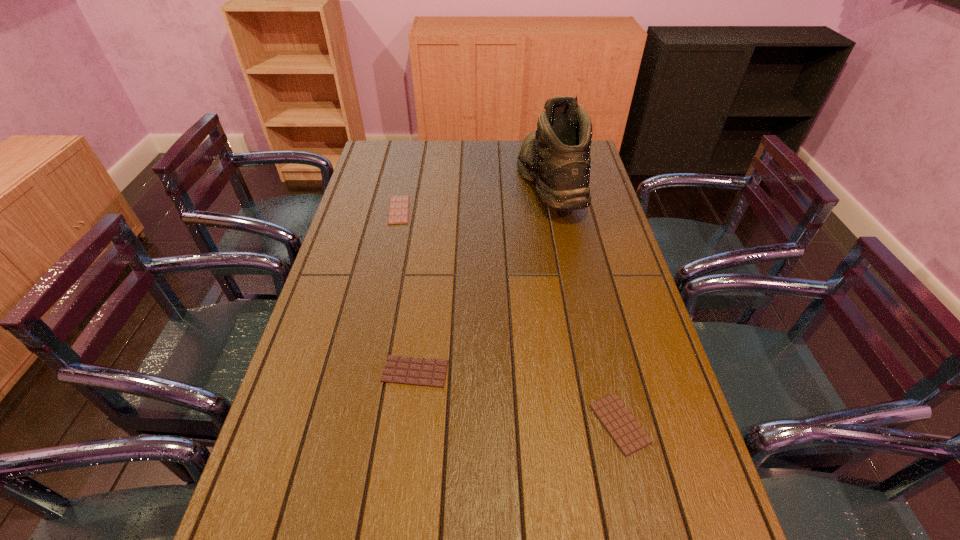
I want to click on the closest object to the second tallest object, so click(417, 371).

Identify which chocolate bar is located as the nearest to the rightmost chocolate bar. Please provide its 2D coordinates. Your answer should be formatted as a tuple, i.e. [(x, y)], where the tuple contains the x and y coordinates of a point satisfying the conditions above.

[(417, 371)]

The image size is (960, 540). In order to click on the third closest chocolate bar to the ski boot in this screenshot , I will do `click(628, 435)`.

Locate an element on the screen. free space that satisfies the following two spatial constraints: 1. on the back side of the second chocolate bar from right to left; 2. on the right side of the ski boot is located at coordinates (438, 184).

This screenshot has height=540, width=960. In order to click on vacant region that satisfies the following two spatial constraints: 1. on the front side of the second nearest object; 2. on the right side of the leftmost chocolate bar in this screenshot , I will do `click(364, 372)`.